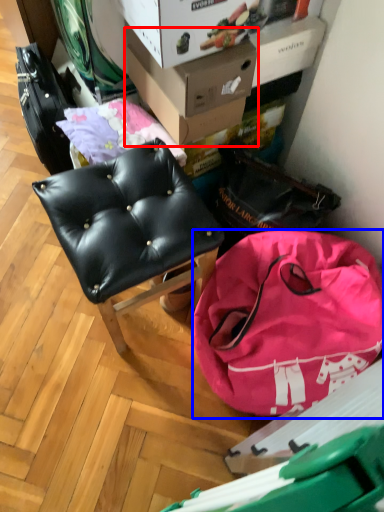
Question: Which object appears farthest to the camera in this image, cardboard box (highlighted by a red box) or handbag (highlighted by a blue box)?

Choices:
 (A) cardboard box
 (B) handbag

Answer: (A)